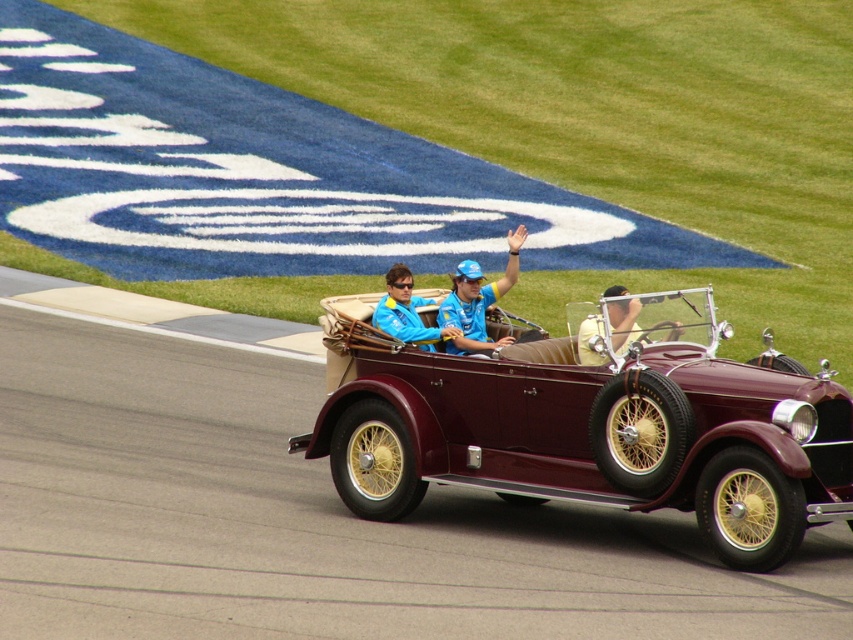
Question: Does maroon leather convertible at center have a smaller size compared to yellow fabric shirt at center?

Choices:
 (A) no
 (B) yes

Answer: (A)

Question: Which point is closer to the camera taking this photo?

Choices:
 (A) (457, 308)
 (B) (585, 317)

Answer: (B)

Question: Which is farther from the maroon leather convertible at center?

Choices:
 (A) matte blue jacket at center
 (B) yellow fabric shirt at center

Answer: (A)

Question: Considering the real-world distances, which object is closest to the matte blue jacket at center?

Choices:
 (A) blue fabric shirt at center
 (B) yellow fabric shirt at center

Answer: (A)

Question: Is blue fabric shirt at center positioned at the back of yellow fabric shirt at center?

Choices:
 (A) no
 (B) yes

Answer: (B)

Question: Where is maroon leather convertible at center located in relation to blue fabric shirt at center in the image?

Choices:
 (A) left
 (B) right

Answer: (B)